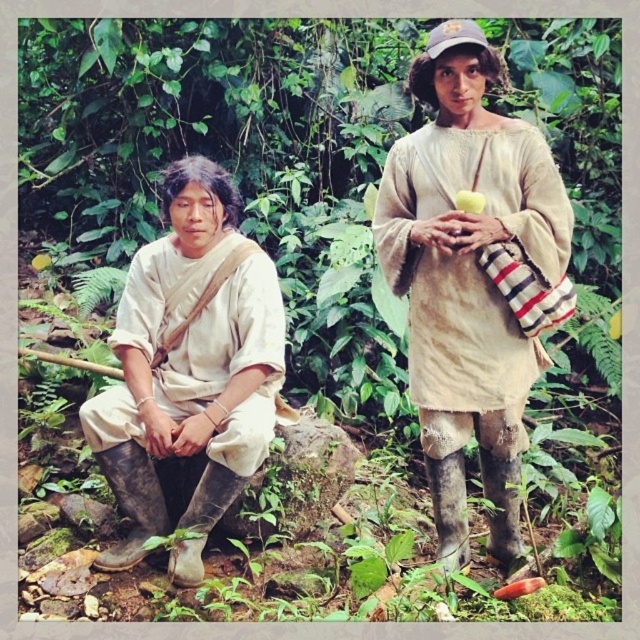
You are an observer in the forest scene. You notice a point at coordinates (189, 368). Which object from the scene does this point correspond to?

The point at coordinates (189, 368) corresponds to the matte white shirt at left.

You are an archer aiming to shoot an arrow between two points in the forest scene. The points are labeled as point [216,337] and point [461,202]. Which point is closer to you, the archer?

Point [216,337] is closer to you than point [461,202].